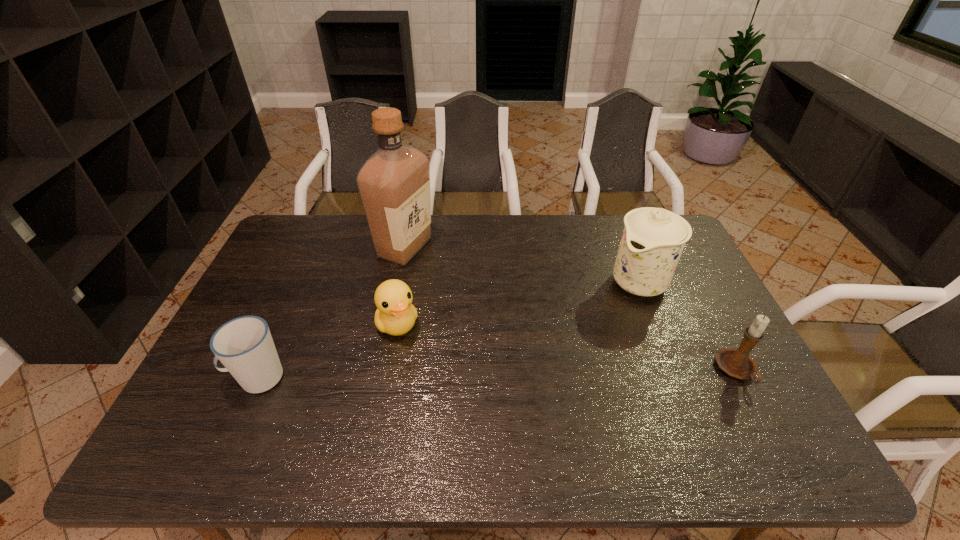
Locate an element on the screen. The image size is (960, 540). vacant space in between the second tallest object and the tallest object is located at coordinates (523, 265).

I want to click on empty location between the leftmost object and the candle holder, so click(497, 374).

Locate an element on the screen. The height and width of the screenshot is (540, 960). unoccupied position between the third farthest object and the cup is located at coordinates (327, 351).

The width and height of the screenshot is (960, 540). Find the location of `empty space between the chinaware and the tallest object`. empty space between the chinaware and the tallest object is located at coordinates (523, 265).

Find the location of a particular element. free spot between the candle holder and the tallest object is located at coordinates (571, 309).

Identify the location of vacant area between the third nearest object and the candle holder. (567, 347).

What are the coordinates of `free spot between the candle holder and the liquor` in the screenshot? It's located at (571, 309).

Identify the location of vacant area that lies between the tallest object and the second tallest object. (523, 265).

I want to click on the fourth closest object relative to the third nearest object, so (x=737, y=363).

Identify the location of object that is the third nearest to the cup. (653, 239).